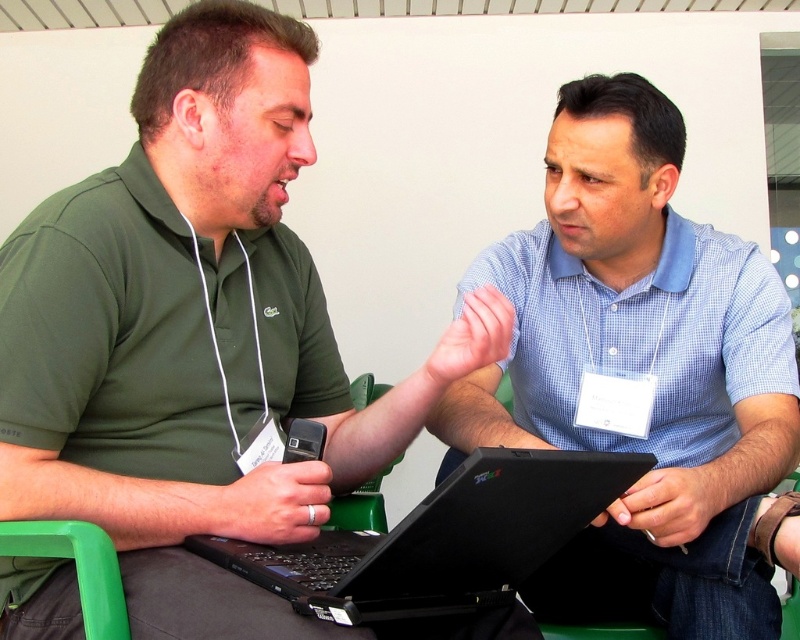
Does blue checkered shirt at center appear on the right side of black matte laptop at center?

Yes, blue checkered shirt at center is to the right of black matte laptop at center.

Which is behind, point (652, 516) or point (274, 563)?

Positioned behind is point (652, 516).

Locate an element on the screen. This screenshot has height=640, width=800. blue checkered shirt at center is located at coordinates (x=641, y=372).

Which is below, green matte shirt at center or blue checkered shirt at center?

blue checkered shirt at center

Does green matte shirt at center appear on the right side of blue checkered shirt at center?

Incorrect, green matte shirt at center is not on the right side of blue checkered shirt at center.

Who is more forward, (274, 12) or (620, 518)?

Point (620, 518)

Locate an element on the screen. The image size is (800, 640). green matte shirt at center is located at coordinates (196, 336).

Is green matte shirt at center shorter than black matte laptop at center?

In fact, green matte shirt at center may be taller than black matte laptop at center.

Is point (225, 532) in front of point (404, 589)?

No, it is behind (404, 589).

I want to click on green matte shirt at center, so click(196, 336).